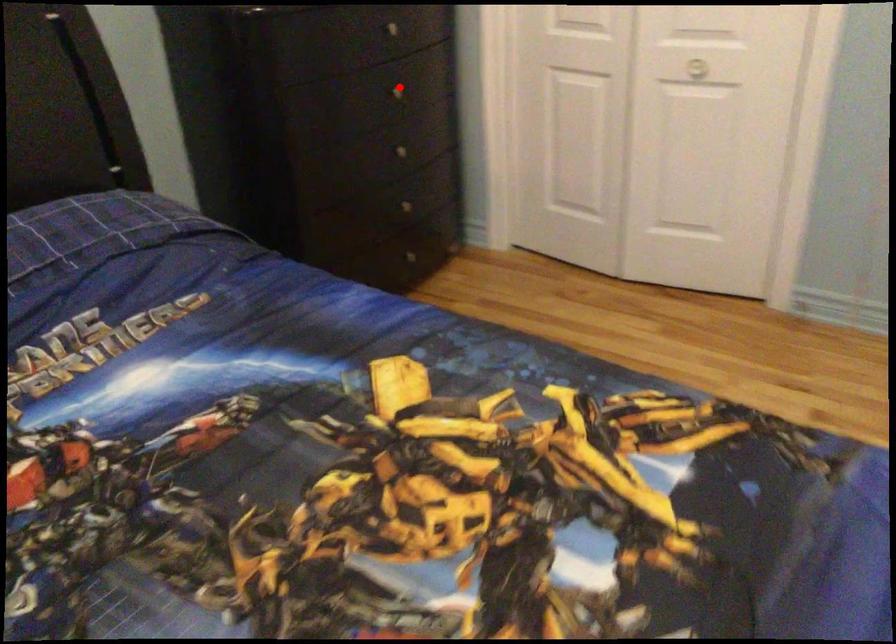
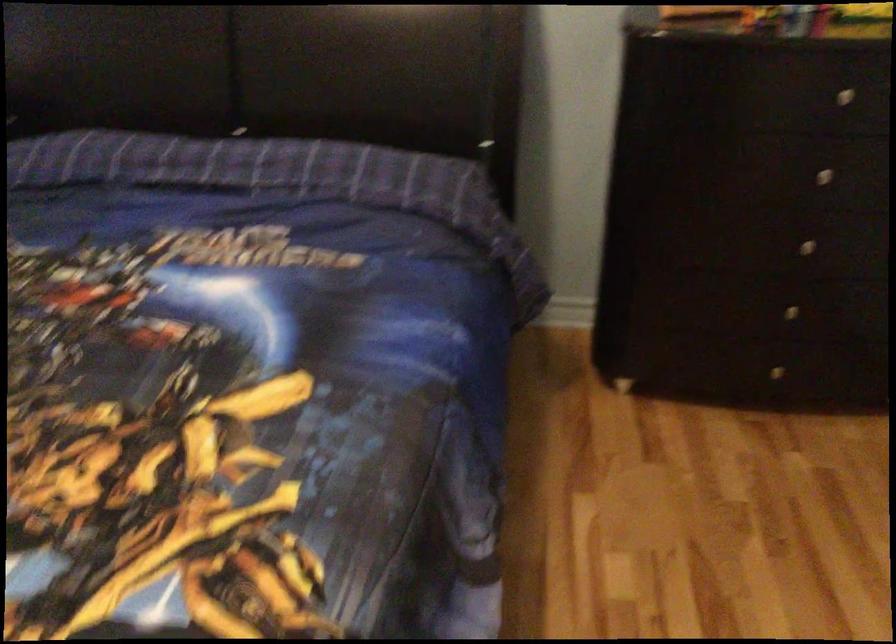
Where in the second image is the point corresponding to the highlighted location from the first image?

(833, 169)